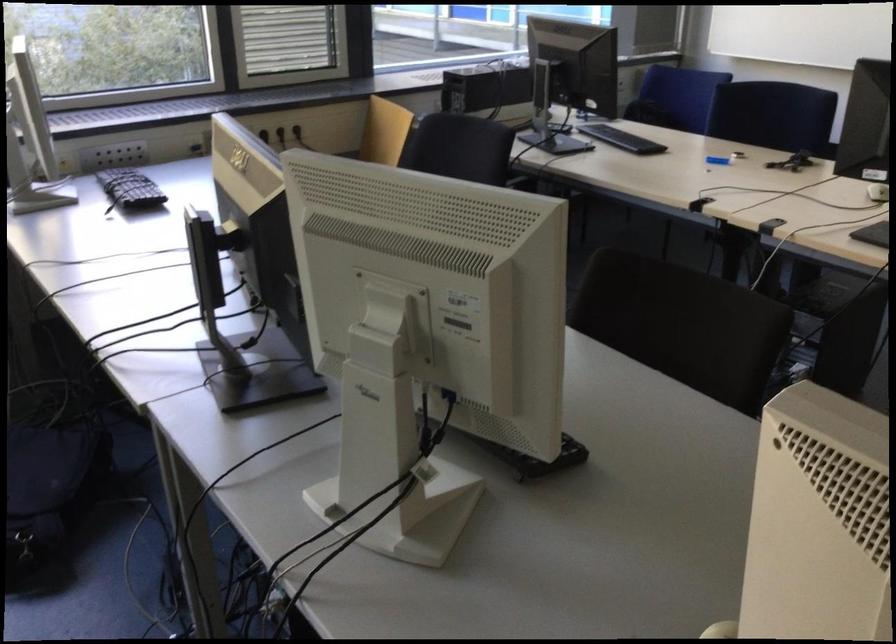
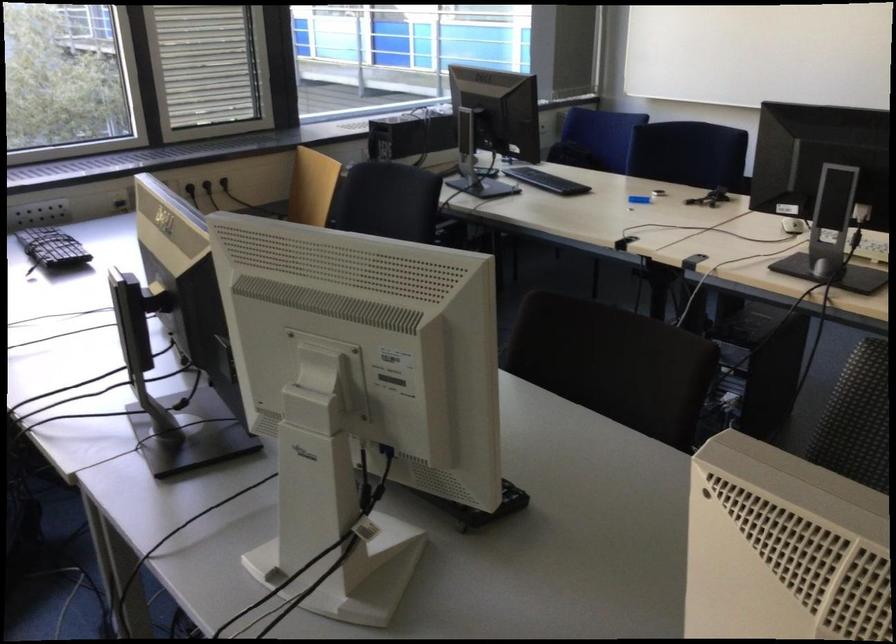
Locate, in the second image, the point that corresponds to [771,115] in the first image.

(687, 153)